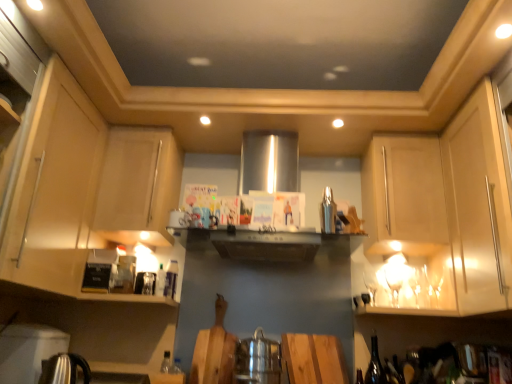
Find the location of `vacant region to the left of translucent plastic bottle at lower left, which appears as the first bottle when viewed from the right`. vacant region to the left of translucent plastic bottle at lower left, which appears as the first bottle when viewed from the right is located at coordinates (140, 303).